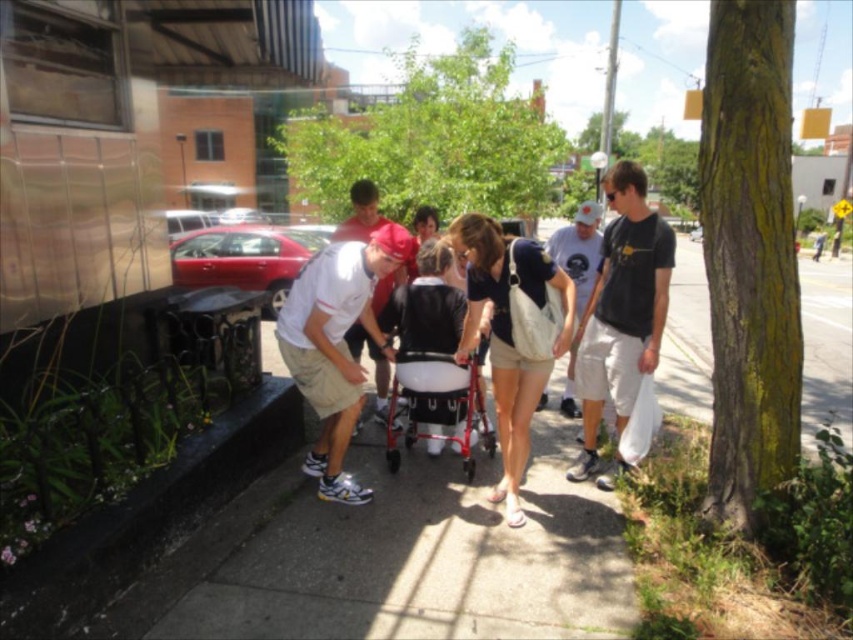
You are a delivery person trying to park your metallic red car at left in a parking spot that can only accommodate vehicles narrower than the matte red cap at center. Can your car fit in the parking spot?

The metallic red car at left is wider than the matte red cap at center, so it cannot fit in the parking spot designed for narrower vehicles.